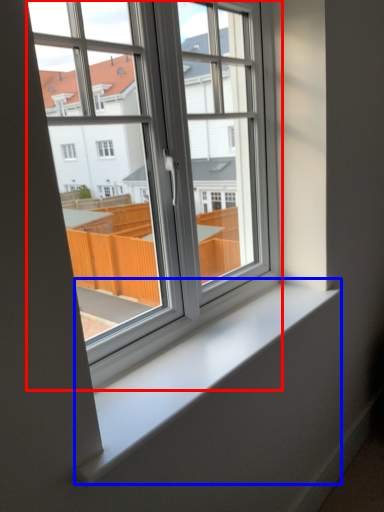
Question: Which point is further to the camera, window (highlighted by a red box) or window sill (highlighted by a blue box)?

Choices:
 (A) window
 (B) window sill

Answer: (B)